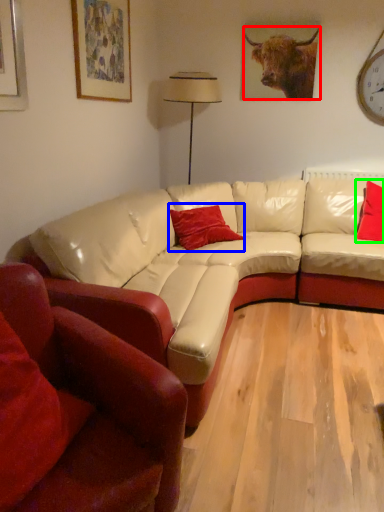
Question: Based on their relative distances, which object is farther from bull (highlighted by a red box)? Choose from pillow (highlighted by a blue box) and pillow (highlighted by a green box).

Choices:
 (A) pillow
 (B) pillow

Answer: (A)